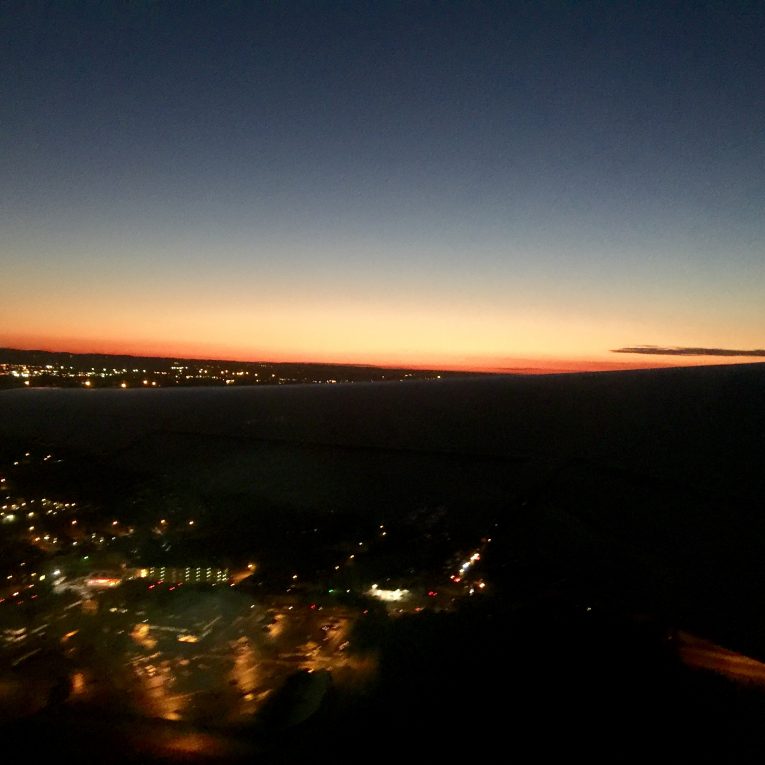
Where is `lights`? lights is located at coordinates (111, 373), (59, 373), (36, 375), (161, 372), (392, 591), (470, 565), (86, 558), (24, 510), (8, 516), (14, 466).